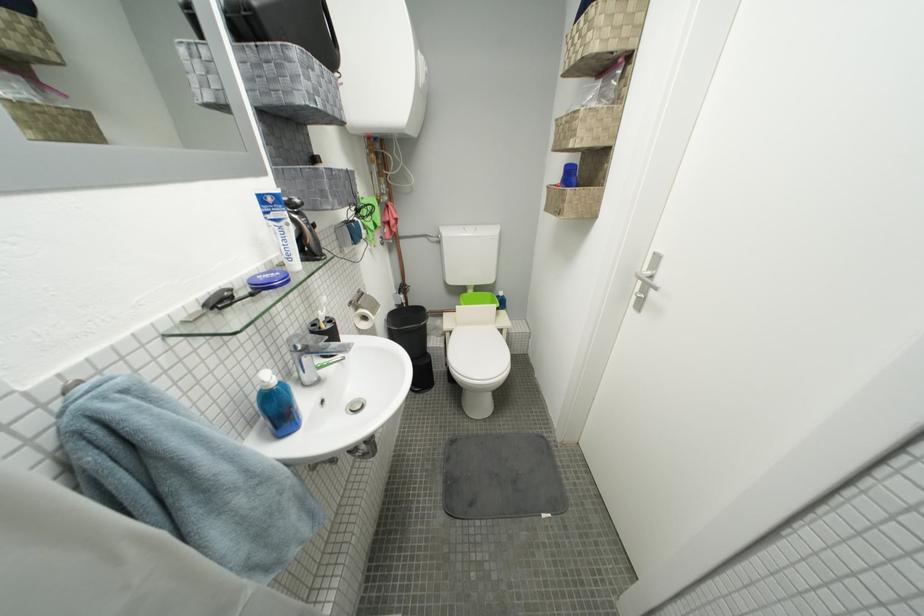
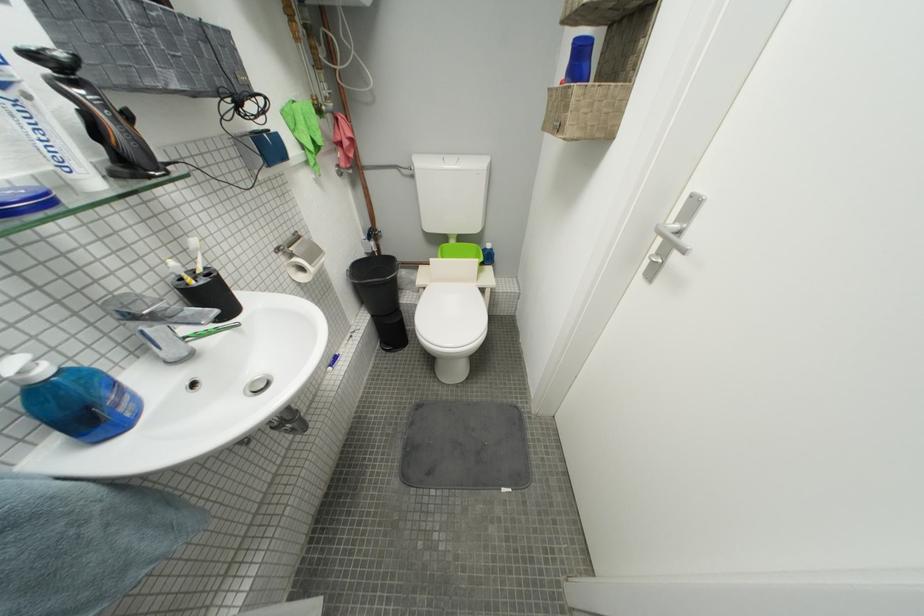
Question: How did the camera likely rotate?

Choices:
 (A) Left
 (B) Right
 (C) Up
 (D) Down

Answer: (D)